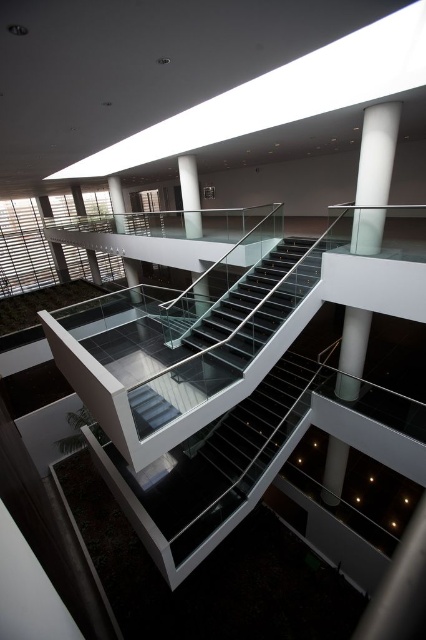
Question: Which object appears closest to the camera in this image?

Choices:
 (A) white glossy pillar at center
 (B) white glossy column at center
 (C) white glossy column at upper center

Answer: (C)

Question: Based on their relative distances, which object is nearer to the white glossy column at center?

Choices:
 (A) white glossy column at upper center
 (B) white glossy pillar at center

Answer: (A)

Question: Is white glossy column at center to the left of white glossy pillar at center from the viewer's perspective?

Choices:
 (A) no
 (B) yes

Answer: (A)

Question: Is white glossy column at center further to the viewer compared to white glossy pillar at center?

Choices:
 (A) no
 (B) yes

Answer: (A)

Question: Does white glossy column at center have a greater width compared to white glossy pillar at center?

Choices:
 (A) no
 (B) yes

Answer: (B)

Question: Which point is farther to the camera?

Choices:
 (A) white glossy pillar at center
 (B) white glossy column at center
 (C) white glossy column at upper center

Answer: (A)